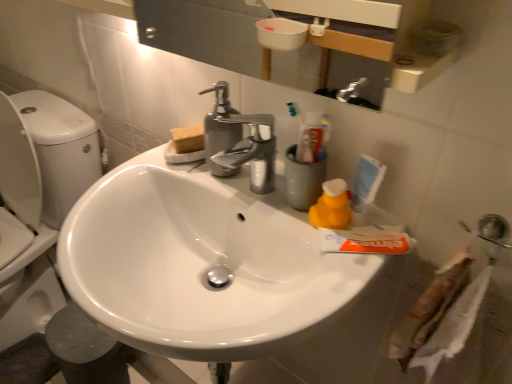
Image resolution: width=512 pixels, height=384 pixels. Identify the location of free space to the left of chrome metallic faucet at center. (155, 173).